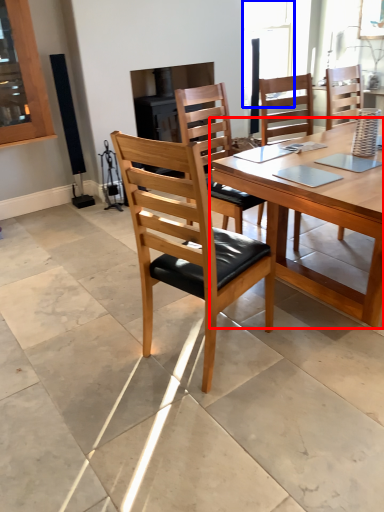
Question: Which object is further to the camera taking this photo, kitchen & dining room table (highlighted by a red box) or window (highlighted by a blue box)?

Choices:
 (A) kitchen & dining room table
 (B) window

Answer: (B)